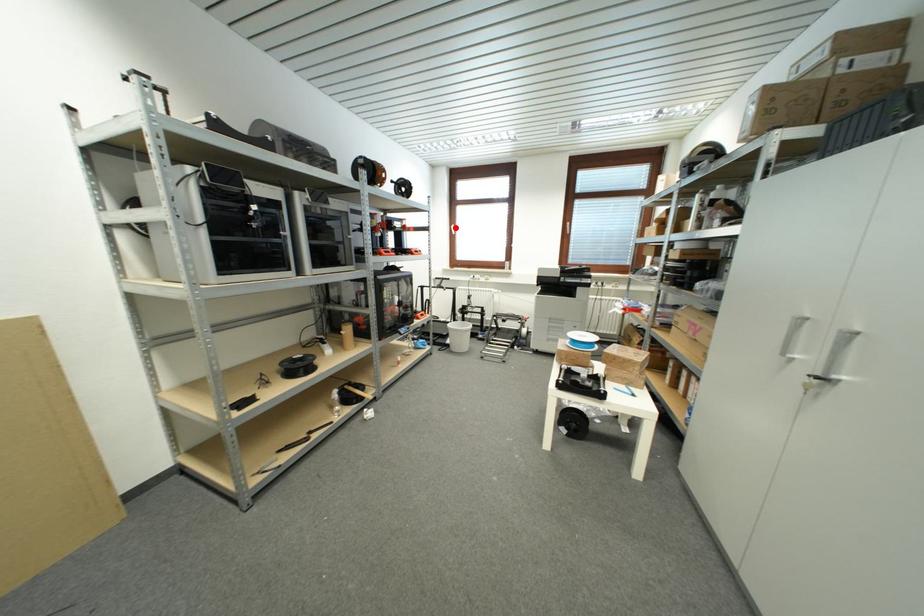
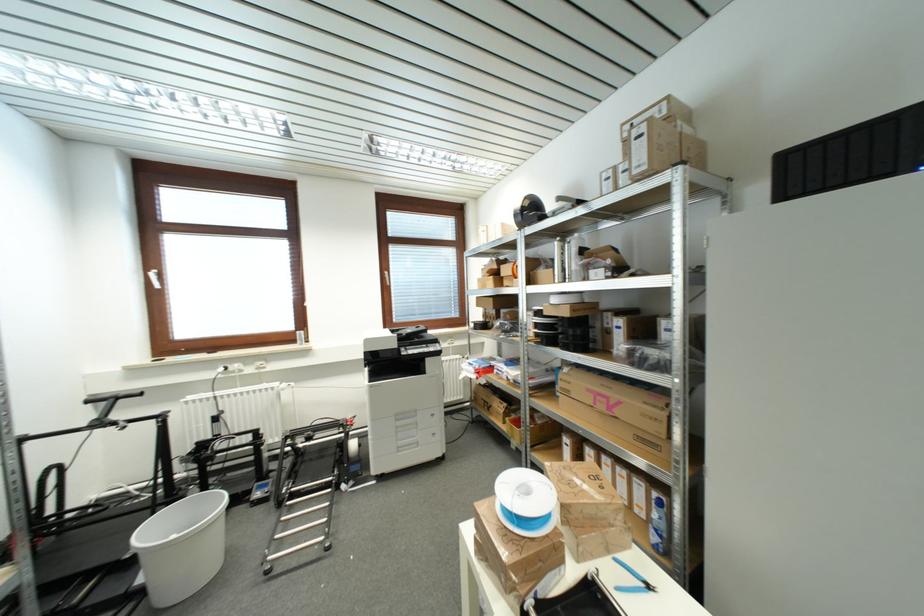
Question: I am providing you with two images of the same scene from different viewpoints. A red point is marked on the first image. Can you still see the location of the red point in image 2?

Choices:
 (A) Yes
 (B) No

Answer: (A)